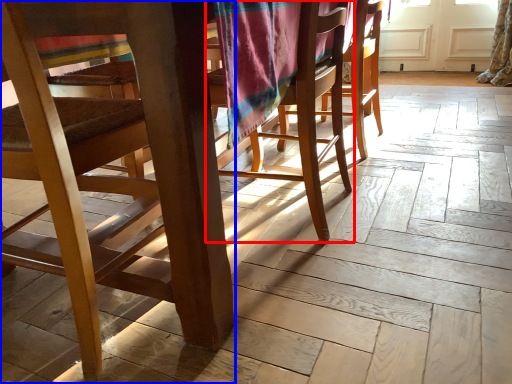
Question: Which object appears closest to the camera in this image, chair (highlighted by a red box) or chair (highlighted by a blue box)?

Choices:
 (A) chair
 (B) chair

Answer: (B)